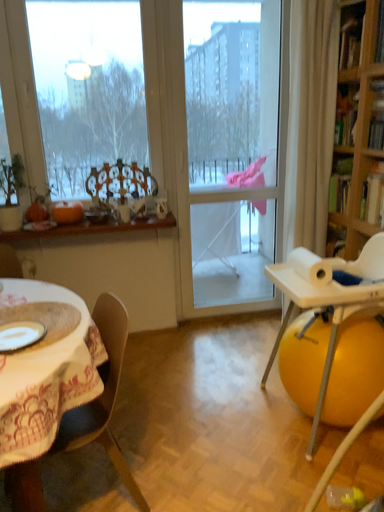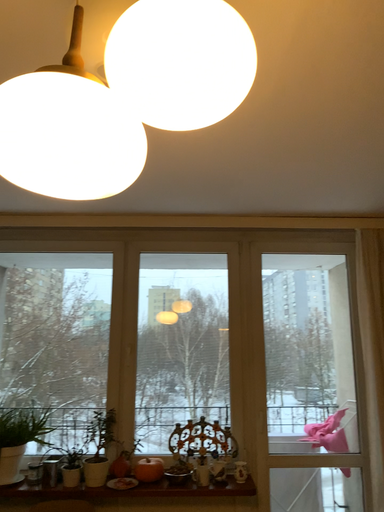
Question: How did the camera likely rotate when shooting the video?

Choices:
 (A) rotated right
 (B) rotated left

Answer: (B)